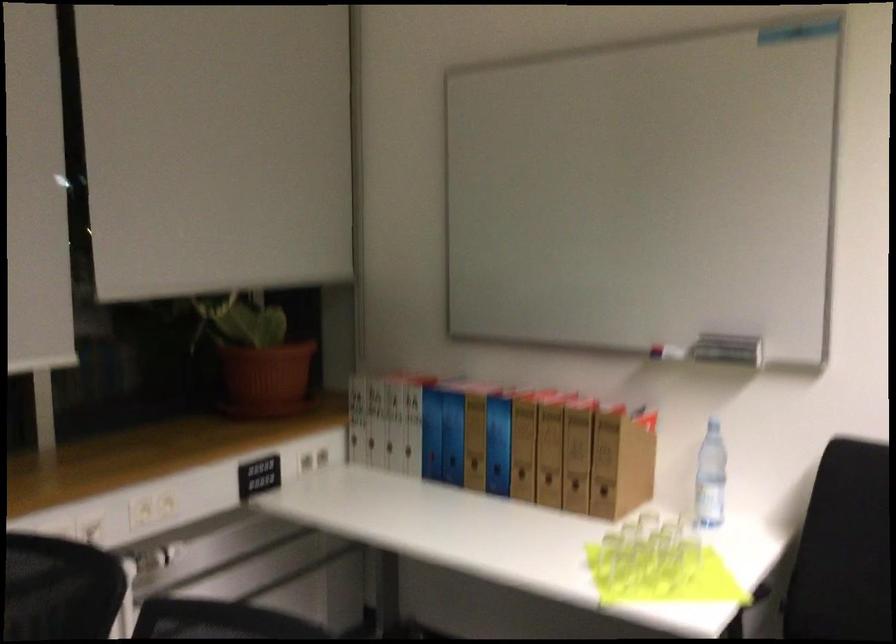
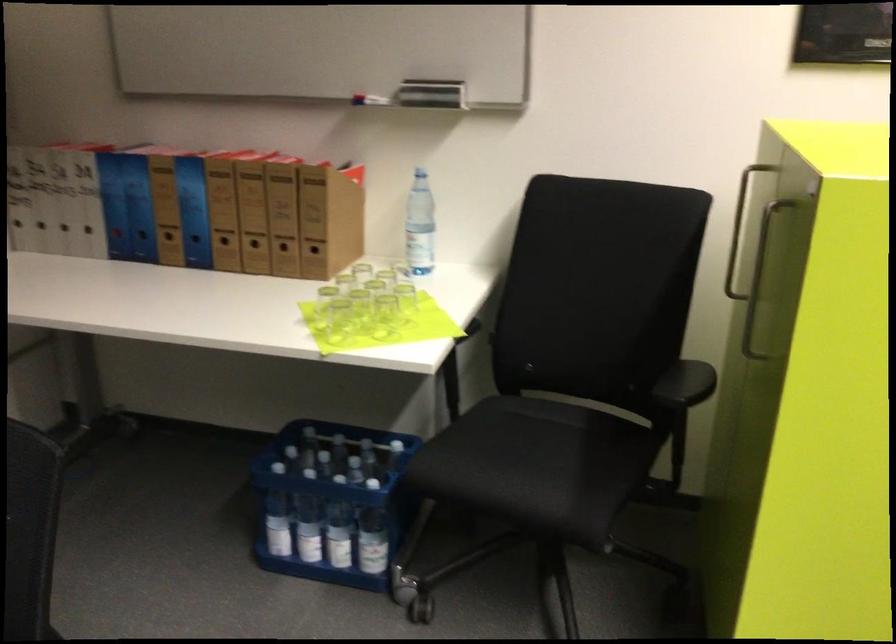
Where in the second image is the point corresponding to the point at 627,571 from the first image?

(339, 319)